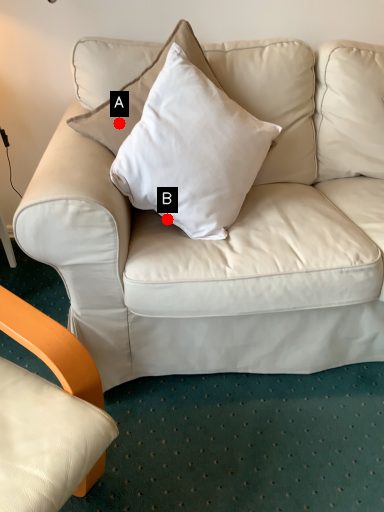
Question: Two points are circled on the image, labeled by A and B beside each circle. Which point is farther to the camera?

Choices:
 (A) A is further
 (B) B is further

Answer: (B)